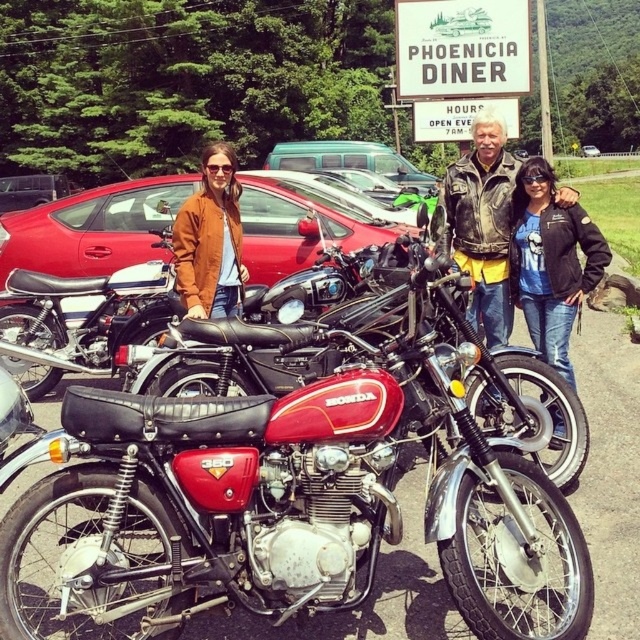
Question: Does metallic red car at center have a lesser width compared to teal metallic van at center?

Choices:
 (A) no
 (B) yes

Answer: (B)

Question: Which of the following is the farthest from the observer?

Choices:
 (A) metallic red car at center
 (B) denim jacket at center
 (C) leather jacket at center

Answer: (A)

Question: Is metallic red car at center below matte brown jacket at center?

Choices:
 (A) yes
 (B) no

Answer: (B)

Question: Is metallic red car at center positioned at the back of matte brown jacket at center?

Choices:
 (A) yes
 (B) no

Answer: (A)

Question: Which point appears closest to the camera in this image?

Choices:
 (A) click(x=520, y=195)
 (B) click(x=228, y=236)
 (C) click(x=477, y=132)
 (D) click(x=364, y=157)

Answer: (A)

Question: Which point is closer to the camera?

Choices:
 (A) leather jacket at center
 (B) matte brown jacket at center

Answer: (A)